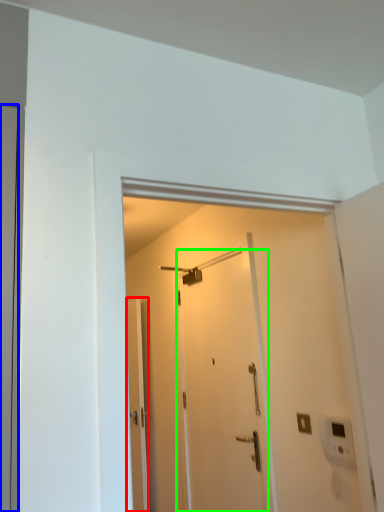
Question: Considering the real-world distances, which object is farthest from door (highlighted by a red box)? door (highlighted by a blue box) or door (highlighted by a green box)?

Choices:
 (A) door
 (B) door

Answer: (A)